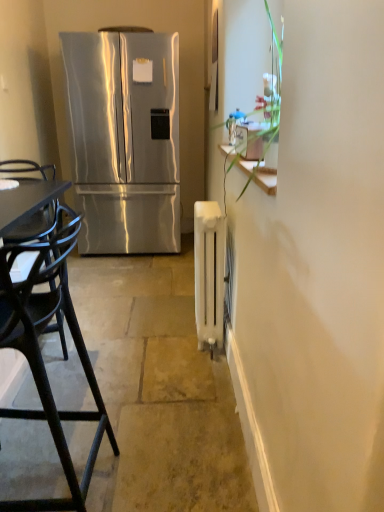
Question: Is satin silver exhaust hood at upper center with black plastic chair at left?

Choices:
 (A) yes
 (B) no

Answer: (B)

Question: Is satin silver exhaust hood at upper center positioned behind black plastic chair at left?

Choices:
 (A) no
 (B) yes

Answer: (B)

Question: From a real-world perspective, is satin silver exhaust hood at upper center positioned under black plastic chair at left based on gravity?

Choices:
 (A) yes
 (B) no

Answer: (B)

Question: Is satin silver exhaust hood at upper center not inside black plastic chair at left?

Choices:
 (A) yes
 (B) no

Answer: (A)

Question: Does satin silver exhaust hood at upper center come in front of black plastic chair at left?

Choices:
 (A) no
 (B) yes

Answer: (A)

Question: Would you say satin silver exhaust hood at upper center is a long distance from black plastic chair at left?

Choices:
 (A) yes
 (B) no

Answer: (A)

Question: Is white matte radiator at right behind white matte radiator at center?

Choices:
 (A) no
 (B) yes

Answer: (A)

Question: From a real-world perspective, is white matte radiator at right on top of white matte radiator at center?

Choices:
 (A) no
 (B) yes

Answer: (A)

Question: From the image's perspective, would you say white matte radiator at right is shown under white matte radiator at center?

Choices:
 (A) no
 (B) yes

Answer: (B)

Question: Is white matte radiator at right oriented towards white matte radiator at center?

Choices:
 (A) no
 (B) yes

Answer: (A)

Question: Can you confirm if white matte radiator at right is shorter than white matte radiator at center?

Choices:
 (A) no
 (B) yes

Answer: (B)

Question: Is white matte radiator at right not inside white matte radiator at center?

Choices:
 (A) yes
 (B) no

Answer: (A)

Question: Can you confirm if black plastic chair at left is wider than stainless steel refrigerator at left?

Choices:
 (A) no
 (B) yes

Answer: (A)